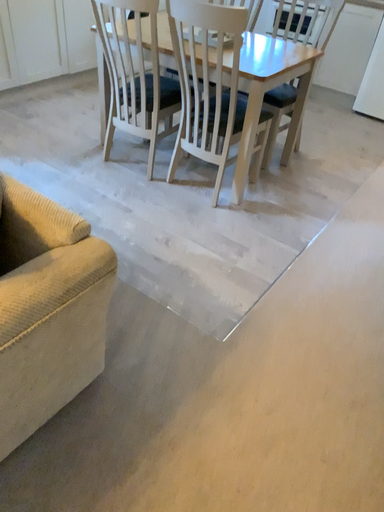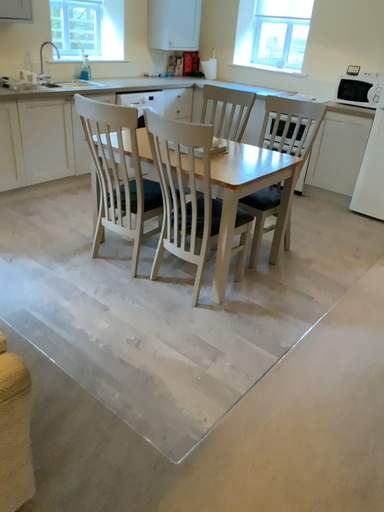
Question: Which way did the camera rotate in the video?

Choices:
 (A) rotated upward
 (B) rotated downward

Answer: (A)